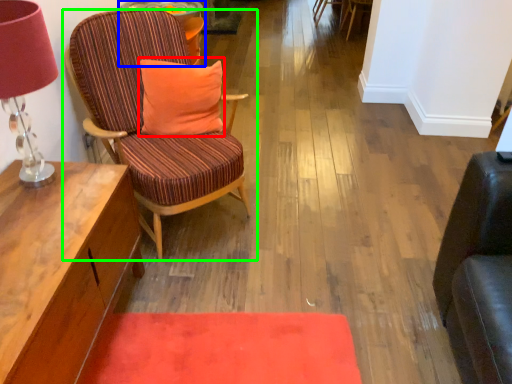
Question: Based on their relative distances, which object is farther from pillow (highlighted by a red box)? Choose from side table (highlighted by a blue box) and chair (highlighted by a green box).

Choices:
 (A) side table
 (B) chair

Answer: (A)